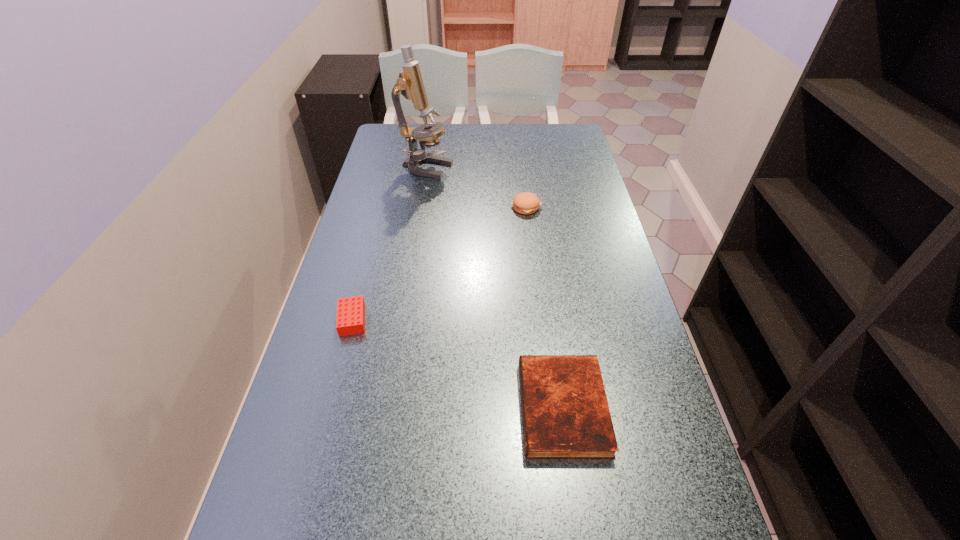
Locate an element on the screen. This screenshot has width=960, height=540. object that stands as the third closest to the third nearest object is located at coordinates (565, 412).